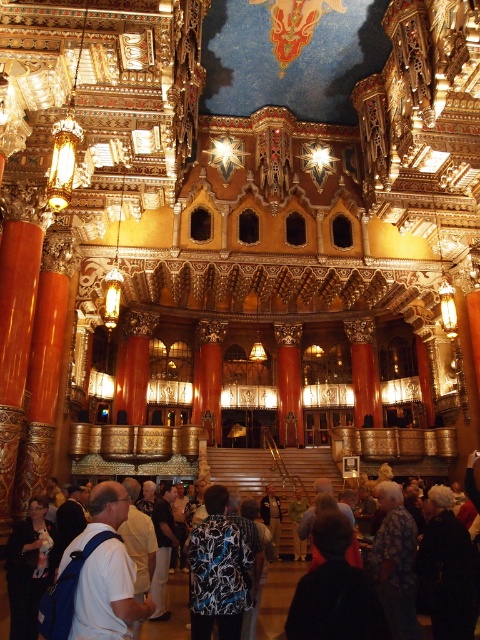
You are standing in the grand theater and want to place a decorative item on the floor. The theater has a black fabric at lower center. Can you place the item exactly at the coordinates given by the theater management as point 0.923, 0.698?

The black fabric at lower center is located at point (335, 589), so placing the item there would require moving the black fabric at lower center first.

You are an event organizer planning a photoshoot in this theater. You need to position two props, the black fabric at lower center and the dark blue shirt at center, in a way that one doesn not overshadow the other. Based on their sizes, which prop should be placed closer to the camera to ensure both are visible clearly?

The black fabric at lower center occupies less space than the dark blue shirt at center, so placing the black fabric at lower center closer to the camera will help balance their visibility since it is smaller and can be positioned to appear larger in the frame without overwhelming the dark blue shirt at center.